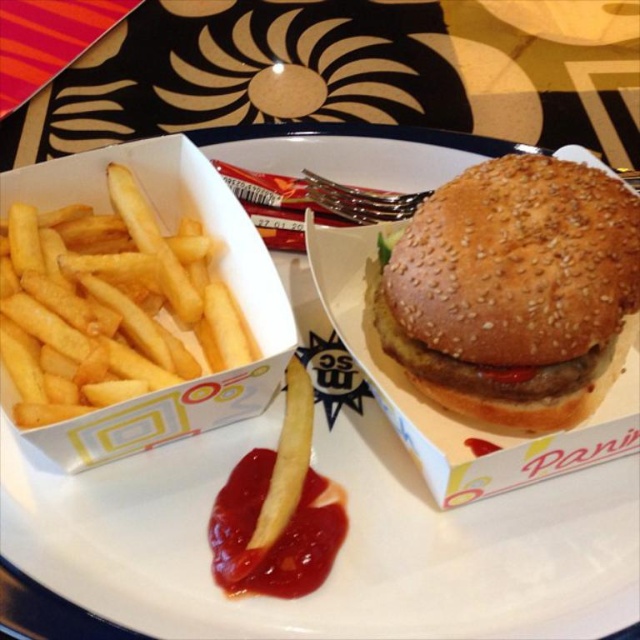
Between sesame seed bun at center and red glossy ketchup at lower center, which one has less height?

red glossy ketchup at lower center

Does point (448, 230) come farther from viewer compared to point (321, 538)?

That is False.

Is point (520, 180) farther from camera compared to point (301, 540)?

Yes, point (520, 180) is behind point (301, 540).

Image resolution: width=640 pixels, height=640 pixels. I want to click on sesame seed bun at center, so click(x=515, y=291).

Is sesame seed bun at center taller than golden crispy french fries at left?

Yes.

Who is taller, sesame seed bun at center or golden crispy french fries at left?

With more height is sesame seed bun at center.

Image resolution: width=640 pixels, height=640 pixels. What are the coordinates of `sesame seed bun at center` in the screenshot? It's located at (515, 291).

This screenshot has width=640, height=640. What are the coordinates of `sesame seed bun at center` in the screenshot? It's located at (515, 291).

How far apart are golden crispy french fries at left and red glossy ketchup at lower center?

The distance of golden crispy french fries at left from red glossy ketchup at lower center is 11.16 inches.

Is point (216, 244) farther from camera compared to point (301, 588)?

Yes, it is behind point (301, 588).

Locate an element on the screen. The width and height of the screenshot is (640, 640). golden crispy french fries at left is located at coordinates tap(108, 305).